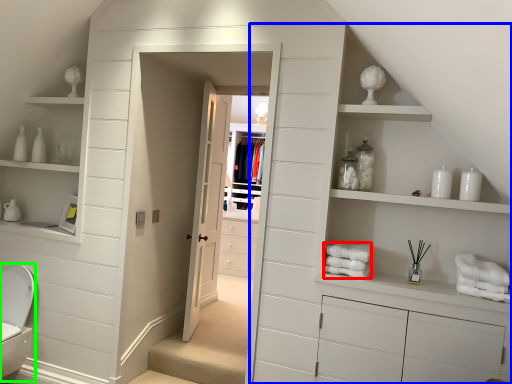
Question: Which object is positioned closest to bath towel (highlighted by a red box)? Select from dresser (highlighted by a blue box) and toilet bowl (highlighted by a green box).

Choices:
 (A) dresser
 (B) toilet bowl

Answer: (A)